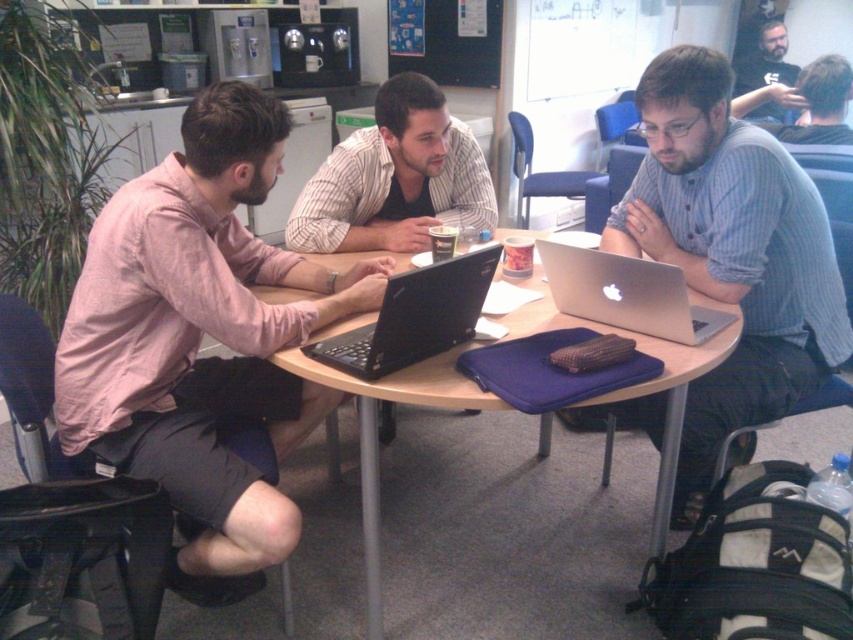
Based on the photo, you are sitting at the round wooden table and want to reach the matte black laptop at center without moving the striped shirt at center. Is this possible?

The matte black laptop at center is in front of the striped shirt at center, so you can reach the matte black laptop at center without moving the striped shirt at center.

You are organizing a group activity and need to ensure everyone has enough space for their laptops. You notice the blue striped shirt at center and the matte black laptop at center. Which object takes up more space on the table?

The matte black laptop at center takes up more space than the blue striped shirt at center because the blue striped shirt at center occupies less space than the matte black laptop at center.